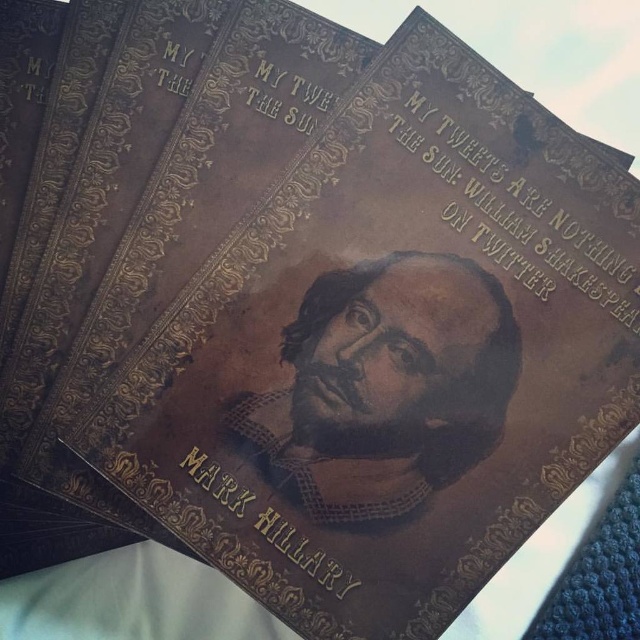
Question: Which point is farther to the camera?

Choices:
 (A) (436, 262)
 (B) (339, 586)

Answer: (A)

Question: Is brown leather portrait at center smaller than gold embossed text at center?

Choices:
 (A) no
 (B) yes

Answer: (A)

Question: Is brown leather portrait at center smaller than gold embossed text at center?

Choices:
 (A) yes
 (B) no

Answer: (B)

Question: Observing the image, what is the correct spatial positioning of brown leather portrait at center in reference to gold embossed text at center?

Choices:
 (A) above
 (B) below

Answer: (A)